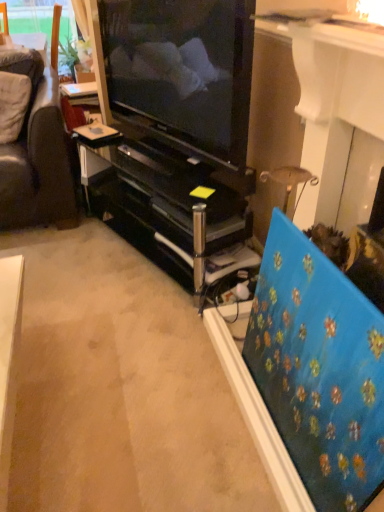
Question: From the image's perspective, is matte black television at center on top of blue textured canvas at right?

Choices:
 (A) yes
 (B) no

Answer: (A)

Question: Is matte black television at center thinner than blue textured canvas at right?

Choices:
 (A) yes
 (B) no

Answer: (B)

Question: From a real-world perspective, is matte black television at center positioned under blue textured canvas at right based on gravity?

Choices:
 (A) yes
 (B) no

Answer: (B)

Question: Is matte black television at center shorter than blue textured canvas at right?

Choices:
 (A) no
 (B) yes

Answer: (A)

Question: Is blue textured canvas at right at the back of matte black television at center?

Choices:
 (A) yes
 (B) no

Answer: (B)

Question: Is matte black television at center taller than blue textured canvas at right?

Choices:
 (A) no
 (B) yes

Answer: (B)

Question: Considering the relative sizes of blue textured canvas at right and matte black television at center in the image provided, is blue textured canvas at right bigger than matte black television at center?

Choices:
 (A) yes
 (B) no

Answer: (B)

Question: From the image's perspective, is blue textured canvas at right over matte black television at center?

Choices:
 (A) yes
 (B) no

Answer: (B)

Question: From a real-world perspective, is blue textured canvas at right positioned over matte black television at center based on gravity?

Choices:
 (A) no
 (B) yes

Answer: (A)

Question: Is blue textured canvas at right closer to the viewer compared to matte black television at center?

Choices:
 (A) no
 (B) yes

Answer: (B)

Question: Can you confirm if blue textured canvas at right is smaller than matte black television at center?

Choices:
 (A) no
 (B) yes

Answer: (B)

Question: Is blue textured canvas at right placed right next to matte black television at center?

Choices:
 (A) no
 (B) yes

Answer: (A)

Question: Does black glossy tv cabinet at center appear on the right side of blue textured canvas at right?

Choices:
 (A) yes
 (B) no

Answer: (B)